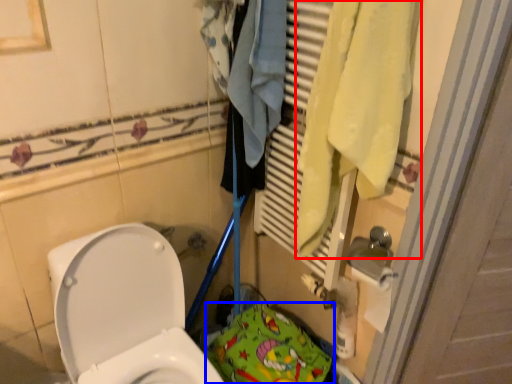
Question: Which point is closer to the camera, bath towel (highlighted by a red box) or material (highlighted by a blue box)?

Choices:
 (A) bath towel
 (B) material

Answer: (A)